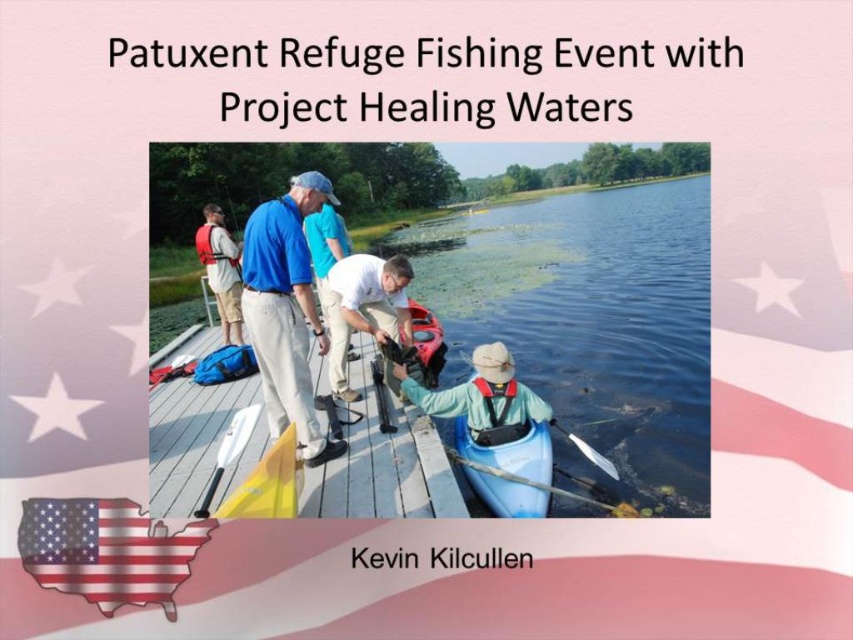
Does matte blue kayak at lower right appear on the left side of yellow matte kayak at lower left?

Incorrect, matte blue kayak at lower right is not on the left side of yellow matte kayak at lower left.

Does point (508, 490) lie in front of point (268, 468)?

No, (508, 490) is behind (268, 468).

This screenshot has width=853, height=640. What are the coordinates of `matte blue kayak at lower right` in the screenshot? It's located at (509, 452).

Is yellow matte kayak at lower left above smooth black paddle at lower right?

Yes, yellow matte kayak at lower left is above smooth black paddle at lower right.

Is point (277, 500) more distant than point (509, 472)?

No, (277, 500) is in front of (509, 472).

Describe the element at coordinates (268, 483) in the screenshot. I see `yellow matte kayak at lower left` at that location.

Identify the location of yellow matte kayak at lower left. (268, 483).

Is white plastic paddle at center above smooth black paddle at lower right?

Yes, white plastic paddle at center is above smooth black paddle at lower right.

Does white plastic paddle at center lie behind smooth black paddle at lower right?

No, it is not.

The image size is (853, 640). What do you see at coordinates (229, 451) in the screenshot? I see `white plastic paddle at center` at bounding box center [229, 451].

I want to click on white plastic paddle at center, so click(x=229, y=451).